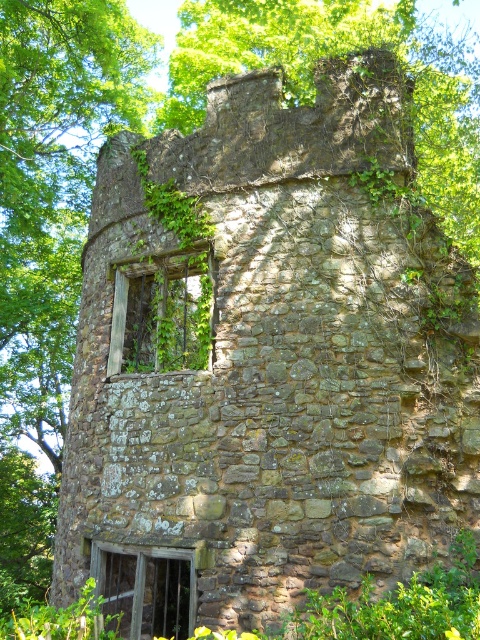
Does green mossy stone window at upper left have a lesser height compared to wooden textured window at lower left?

Incorrect, green mossy stone window at upper left's height does not fall short of wooden textured window at lower left's.

Describe the element at coordinates (164, 310) in the screenshot. The height and width of the screenshot is (640, 480). I see `green mossy stone window at upper left` at that location.

Identify the location of green mossy stone window at upper left. (164, 310).